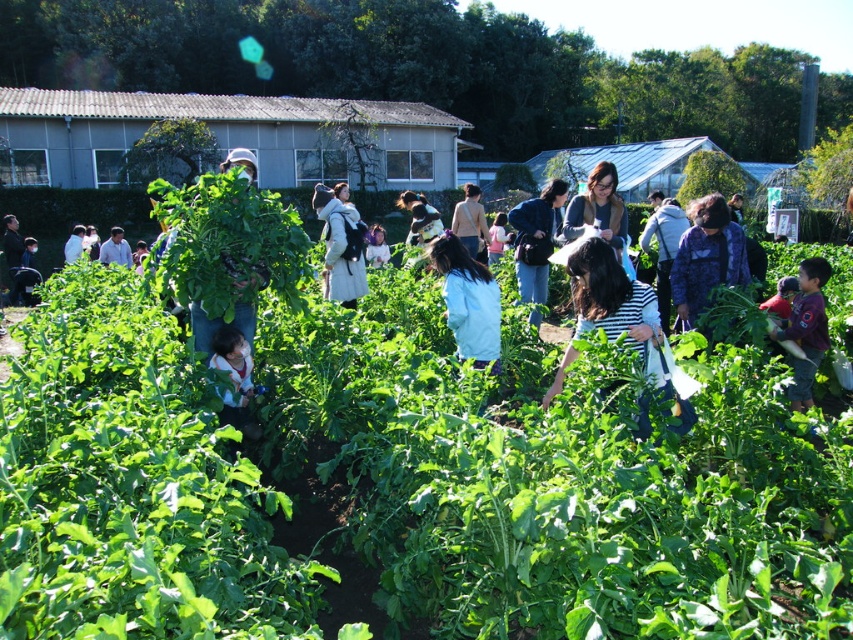
Question: Based on their relative distances, which object is nearer to the green leafy vegetables at center?

Choices:
 (A) matte green shirt at center
 (B) striped cotton shirt at center

Answer: (A)

Question: Is green leafy vegetables at center positioned in front of denim jacket at center?

Choices:
 (A) yes
 (B) no

Answer: (A)

Question: Which point is closer to the camera taking this photo?

Choices:
 (A) (242, 419)
 (B) (457, 211)
 (C) (717, 532)

Answer: (C)

Question: Which object is the closest to the denim jacket at center?

Choices:
 (A) light brown fabric jacket at center
 (B) blue patterned jacket at center

Answer: (A)

Question: Does striped cotton shirt at center have a lesser width compared to light blue fabric at center?

Choices:
 (A) no
 (B) yes

Answer: (B)

Question: Does striped cotton shirt at center appear under matte green shirt at center?

Choices:
 (A) no
 (B) yes

Answer: (A)